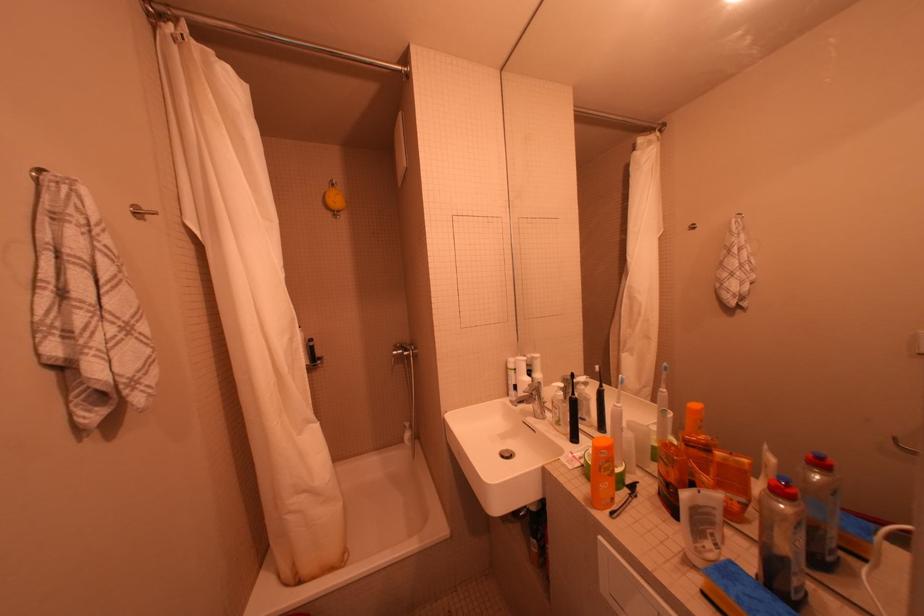
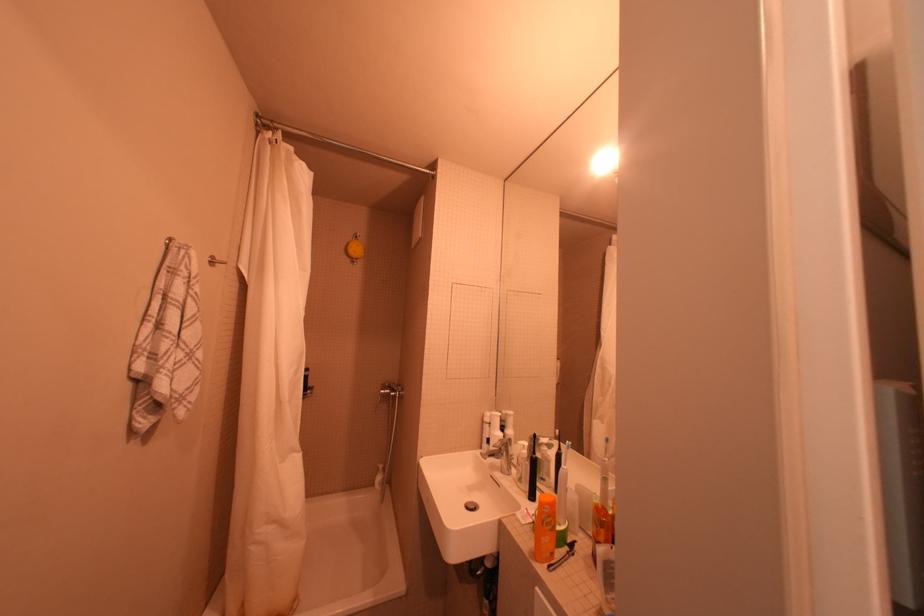
Question: The images are taken continuously from a first-person perspective. In which direction are you moving?

Choices:
 (A) Left
 (B) Right
 (C) Forward
 (D) Backward

Answer: (D)